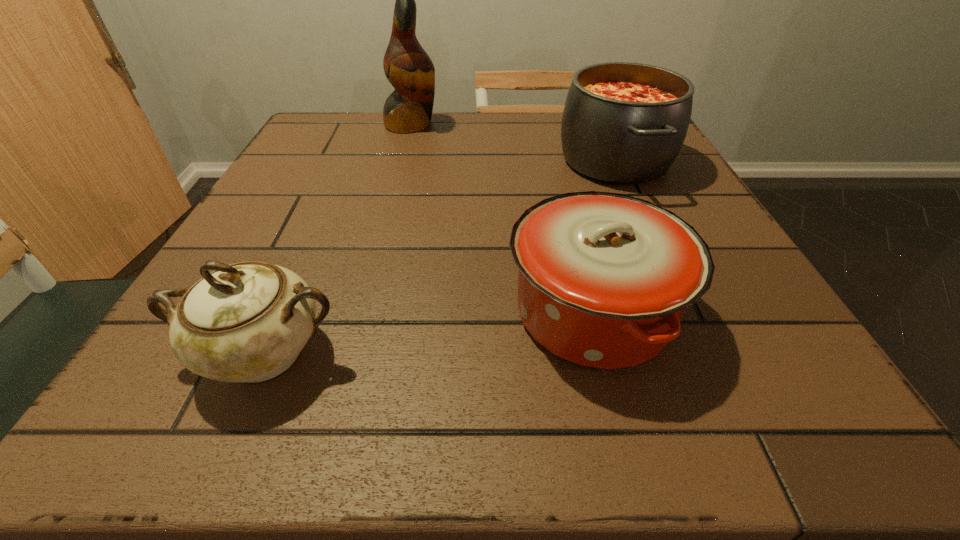
The width and height of the screenshot is (960, 540). In order to click on parrot in this screenshot , I will do `click(409, 69)`.

Find the location of `the farther casserole`. the farther casserole is located at coordinates (625, 123).

Where is `chinaware`? chinaware is located at coordinates (248, 321).

Identify the location of the nearer casserole. The width and height of the screenshot is (960, 540). (x=604, y=278).

I want to click on vacant space located 0.170m on the face of the parrot, so click(x=507, y=124).

You are a GUI agent. You are given a task and a screenshot of the screen. Output one action in this format:
    pyautogui.click(x=<x>, y=<y>)
    Task: Click on the free space located 0.370m on the left of the farther casserole
    This screenshot has width=960, height=540.
    Given the screenshot: What is the action you would take?
    pyautogui.click(x=388, y=160)

The height and width of the screenshot is (540, 960). Identify the location of free space located on the back of the chinaware. (302, 267).

At what (x,y) coordinates should I click in order to perform the action: click on vacant space located on the left of the nearer casserole. Please return your answer as a coordinate pair (x, y). The height and width of the screenshot is (540, 960). Looking at the image, I should click on (276, 312).

You are a GUI agent. You are given a task and a screenshot of the screen. Output one action in this format:
    pyautogui.click(x=<x>, y=<y>)
    Task: Click on the parrot located in the far edge section of the desktop
    
    Given the screenshot: What is the action you would take?
    coord(409,69)

Where is `casserole situated at the far edge`? This screenshot has height=540, width=960. casserole situated at the far edge is located at coordinates (625, 123).